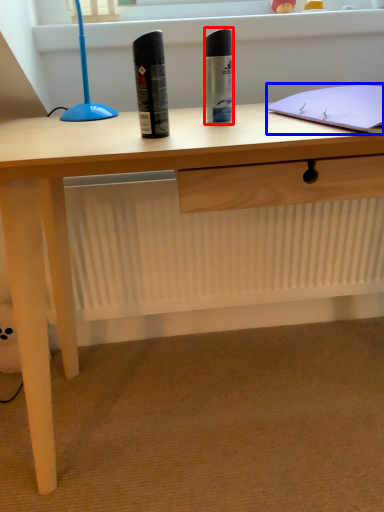
Question: Which object appears farthest to the camera in this image, stationery (highlighted by a red box) or notebook (highlighted by a blue box)?

Choices:
 (A) stationery
 (B) notebook

Answer: (A)